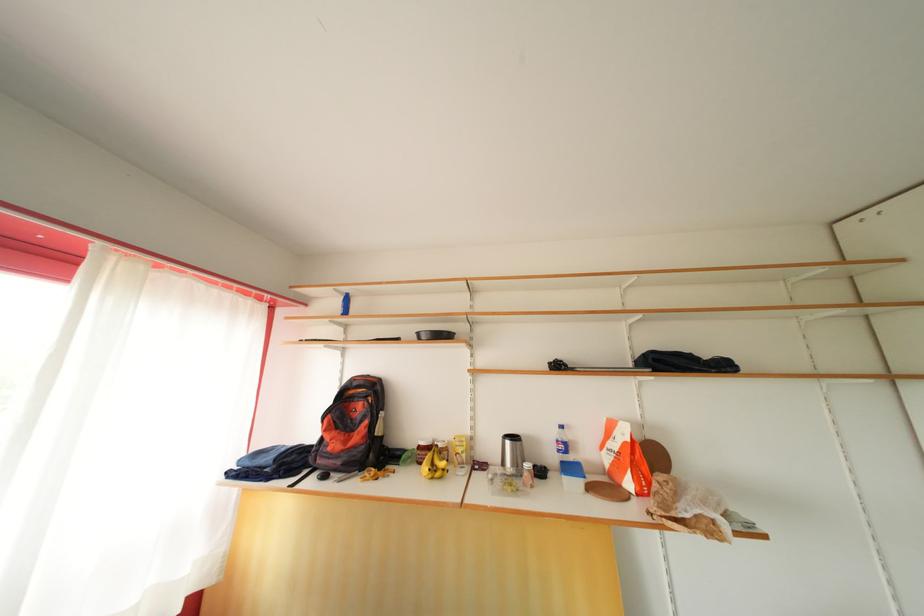
This screenshot has width=924, height=616. Describe the element at coordinates (434, 334) in the screenshot. I see `the black pan` at that location.